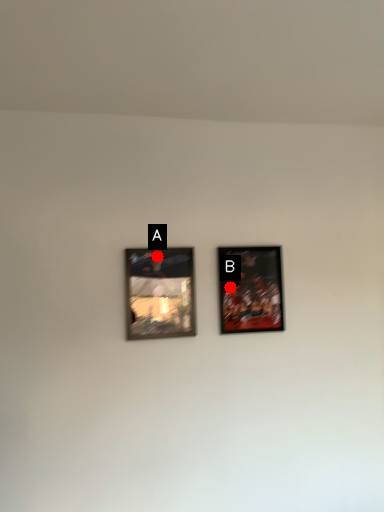
Question: Two points are circled on the image, labeled by A and B beside each circle. Which point is closer to the camera?

Choices:
 (A) A is closer
 (B) B is closer

Answer: (A)